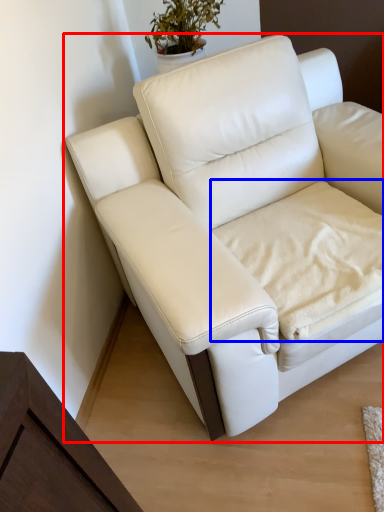
Question: Which object is closer to the camera taking this photo, studio couch (highlighted by a red box) or sheet (highlighted by a blue box)?

Choices:
 (A) studio couch
 (B) sheet

Answer: (A)